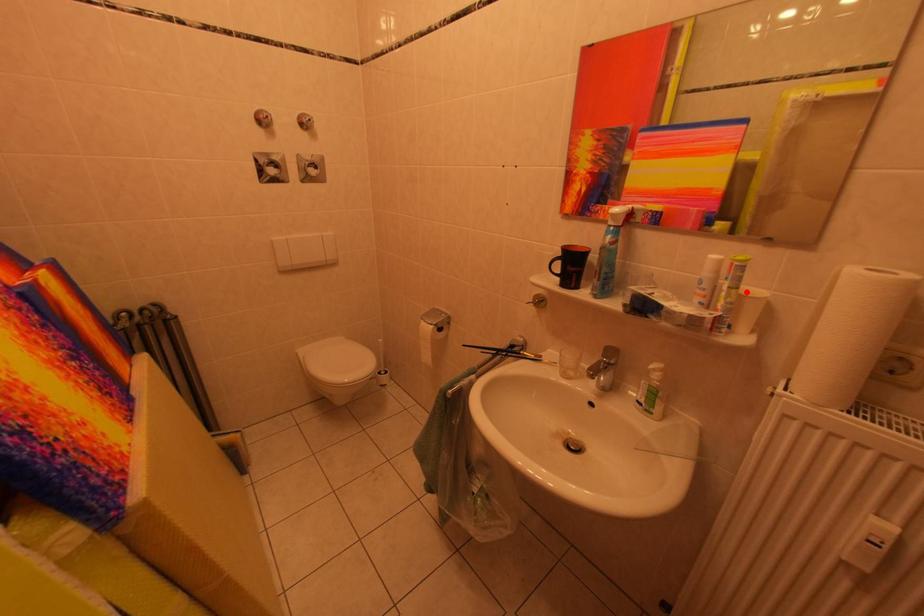
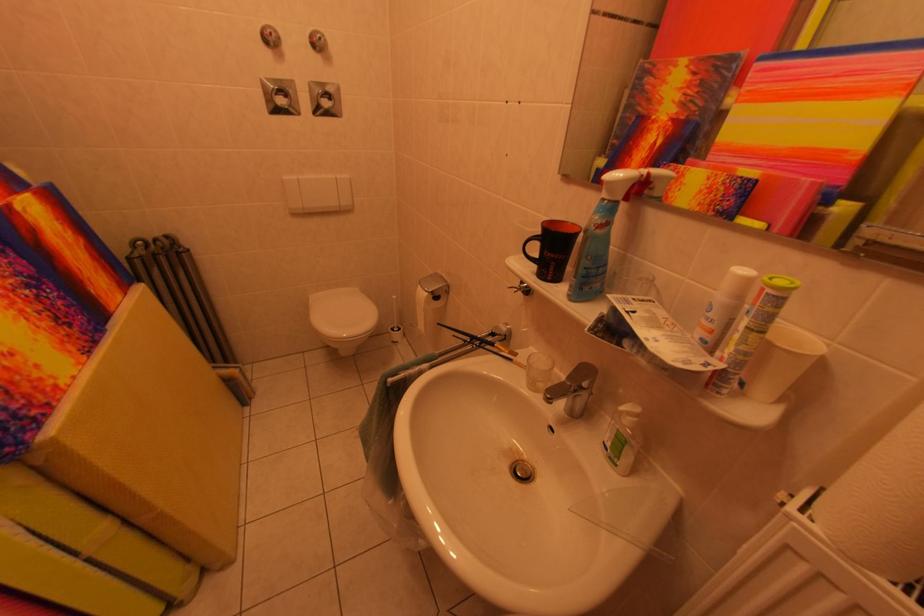
Where in the second image is the point corresponding to the highlighted location from the first image?

(773, 336)